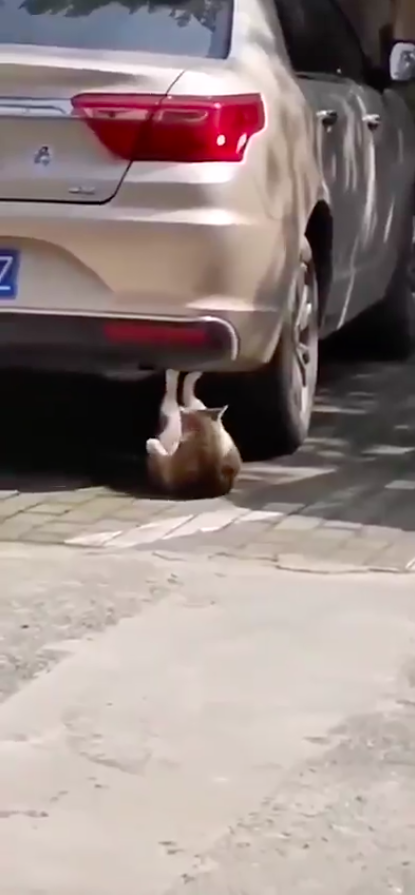
At what (x,y) coordinates should I click in order to perform the action: click on right mirror. Please return your answer as a coordinate pair (x, y). Looking at the image, I should click on (400, 64).